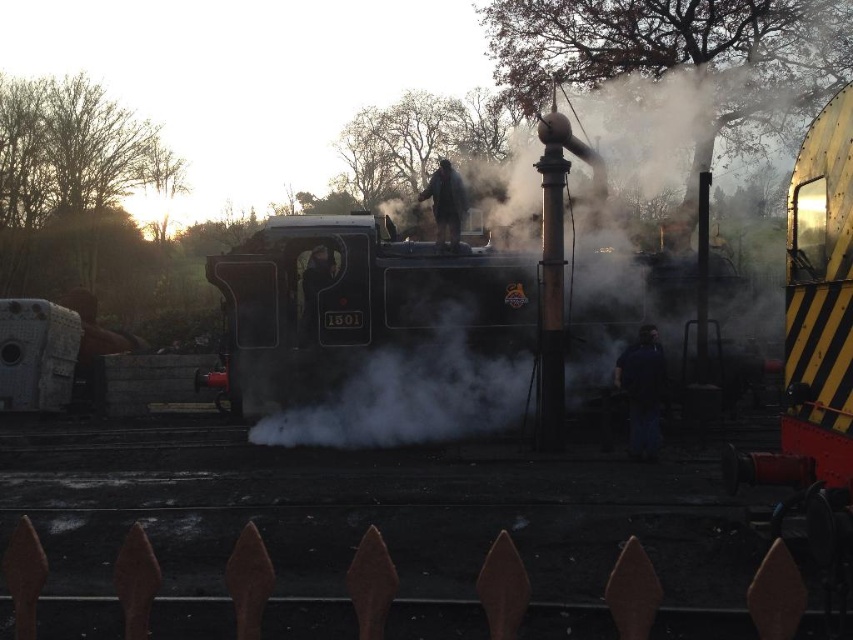
From the picture: You are a photographer aiming to capture a clear shot of both the dark blue fabric at center and the dark gray fabric jacket at center. Which object should you focus on first to ensure both are in focus?

The dark blue fabric at center is closer to the viewer than the dark gray fabric jacket at center. To ensure both are in focus, focus on the dark blue fabric at center first as it is closer, allowing the jacket to fall within the depth of field.

You are a safety inspector at the railway station. You need to ensure that the two workers on the steam locomotive are maintaining a safe distance from each other. The minimum required distance between workers is 5 meters. Based on the image, are the dark blue fabric at center and dark fabric jacket at center meeting the safety requirement?

The distance between the dark blue fabric at center and dark fabric jacket at center is 4.86 meters, which is less than the required 5 meters. Therefore, they are not maintaining the safe distance.